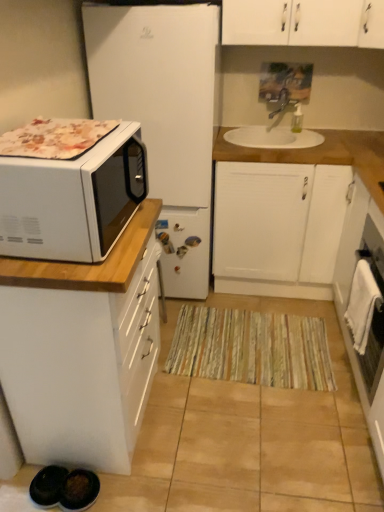
Question: From the image's perspective, would you say white glossy oven at right is positioned over white matte refrigerator at left?

Choices:
 (A) no
 (B) yes

Answer: (A)

Question: Could white matte refrigerator at left be considered to be inside white glossy oven at right?

Choices:
 (A) yes
 (B) no

Answer: (B)

Question: Would you say white glossy oven at right is outside white matte refrigerator at left?

Choices:
 (A) yes
 (B) no

Answer: (A)

Question: Is the depth of white glossy oven at right less than that of white matte refrigerator at left?

Choices:
 (A) no
 (B) yes

Answer: (B)

Question: Considering the relative sizes of white glossy oven at right and white matte refrigerator at left in the image provided, is white glossy oven at right wider than white matte refrigerator at left?

Choices:
 (A) no
 (B) yes

Answer: (A)

Question: Is white glossy microwave at left, which is the second cabinetry in right-to-left order, spatially inside white matte refrigerator at left, or outside of it?

Choices:
 (A) outside
 (B) inside

Answer: (A)

Question: Considering their positions, is white glossy microwave at left, which is the second cabinetry in right-to-left order, located in front of or behind white matte refrigerator at left?

Choices:
 (A) behind
 (B) front

Answer: (B)

Question: From a real-world perspective, relative to white matte refrigerator at left, is white glossy microwave at left, placed as the second cabinetry when sorted from back to front, vertically above or below?

Choices:
 (A) above
 (B) below

Answer: (B)

Question: Is point (67, 270) positioned closer to the camera than point (175, 40)?

Choices:
 (A) closer
 (B) farther

Answer: (A)

Question: From their relative heights in the image, would you say striped fabric doormat at center is taller or shorter than white glossy oven at right?

Choices:
 (A) short
 (B) tall

Answer: (A)

Question: Considering the positions of point (332, 376) and point (379, 375), is point (332, 376) closer or farther from the camera than point (379, 375)?

Choices:
 (A) closer
 (B) farther

Answer: (B)

Question: Visually, is striped fabric doormat at center positioned to the left or to the right of white glossy oven at right?

Choices:
 (A) left
 (B) right

Answer: (A)

Question: Relative to white glossy oven at right, is striped fabric doormat at center in front or behind?

Choices:
 (A) front
 (B) behind

Answer: (B)

Question: In the image, is white glossy oven at right positioned in front of or behind white glossy microwave at left, positioned as the 1th cabinetry in left-to-right order?

Choices:
 (A) front
 (B) behind

Answer: (B)

Question: Is white glossy oven at right wider or thinner than white glossy microwave at left, placed as the second cabinetry when sorted from back to front?

Choices:
 (A) thin
 (B) wide

Answer: (A)